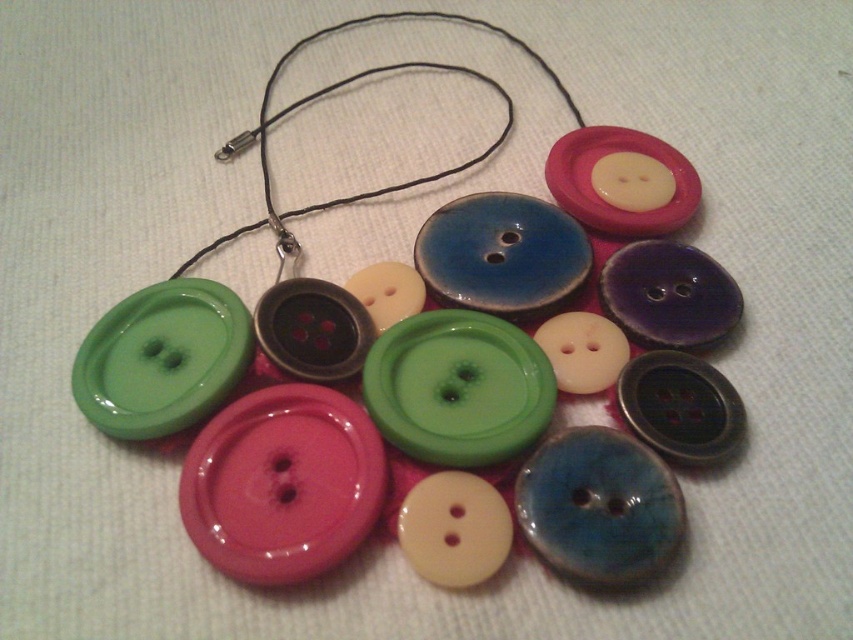
Can you confirm if glossy plastic buttons at center is positioned to the left of black cord at upper center?

Incorrect, glossy plastic buttons at center is not on the left side of black cord at upper center.

Who is positioned more to the left, glossy plastic buttons at center or black cord at upper center?

black cord at upper center

Does point (166, 353) lie in front of point (271, 84)?

Yes.

At what (x,y) coordinates should I click in order to perform the action: click on glossy plastic buttons at center. Please return your answer as a coordinate pair (x, y). The width and height of the screenshot is (853, 640). Looking at the image, I should click on (395, 433).